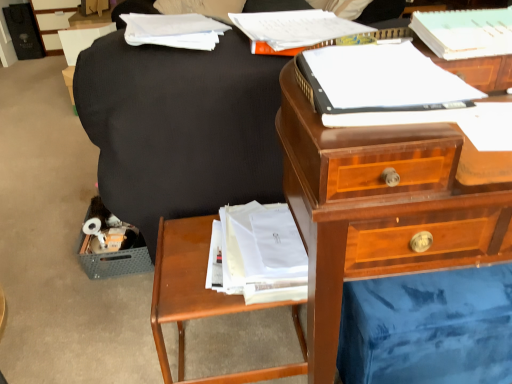
Question: Is matte black swivel chair at center oriented away from white paper at upper right, which is counted as the third paperback book, starting from the back?

Choices:
 (A) yes
 (B) no

Answer: (A)

Question: Is matte black swivel chair at center in front of white paper at upper right, which is counted as the third paperback book, starting from the back?

Choices:
 (A) no
 (B) yes

Answer: (A)

Question: Considering the relative sizes of matte black swivel chair at center and white paper at upper right, acting as the 1th paperback book starting from the front, in the image provided, is matte black swivel chair at center taller than white paper at upper right, acting as the 1th paperback book starting from the front,?

Choices:
 (A) no
 (B) yes

Answer: (B)

Question: From the image's perspective, is matte black swivel chair at center below white paper at upper right, which is counted as the third paperback book, starting from the back?

Choices:
 (A) no
 (B) yes

Answer: (A)

Question: Is matte black swivel chair at center at the left side of white paper at upper right, acting as the 1th paperback book starting from the front?

Choices:
 (A) yes
 (B) no

Answer: (B)

Question: Is matte black swivel chair at center smaller than white paper at upper right, which is counted as the third paperback book, starting from the back?

Choices:
 (A) yes
 (B) no

Answer: (B)

Question: Considering the relative positions of matte black file cabinet at upper left and white paper at upper left in the image provided, is matte black file cabinet at upper left to the left of white paper at upper left from the viewer's perspective?

Choices:
 (A) yes
 (B) no

Answer: (A)

Question: Is matte black file cabinet at upper left closer to the viewer compared to white paper at upper left?

Choices:
 (A) no
 (B) yes

Answer: (A)

Question: Is matte black file cabinet at upper left positioned beyond the bounds of white paper at upper left?

Choices:
 (A) yes
 (B) no

Answer: (A)

Question: From the image's perspective, is matte black file cabinet at upper left above white paper at upper left?

Choices:
 (A) no
 (B) yes

Answer: (B)

Question: From a real-world perspective, is matte black file cabinet at upper left physically above white paper at upper left?

Choices:
 (A) no
 (B) yes

Answer: (A)

Question: Is matte black file cabinet at upper left wider than white paper at upper left?

Choices:
 (A) no
 (B) yes

Answer: (B)

Question: Is white paper at upper center, marked as the 3th paperback book in a front-to-back arrangement, smaller than wooden nightstand at lower left?

Choices:
 (A) yes
 (B) no

Answer: (A)